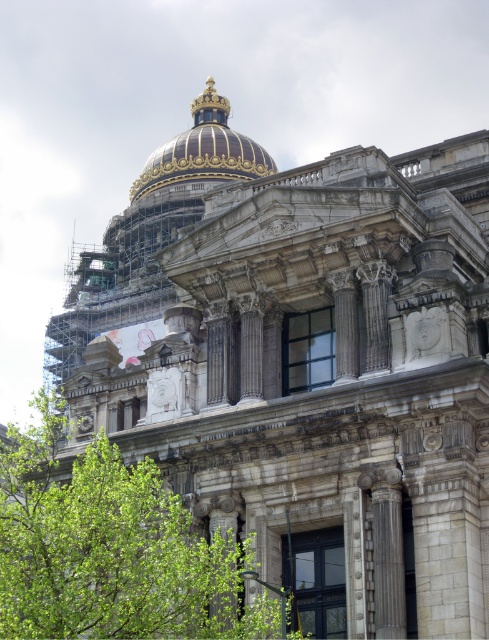
You are standing in front of the grand building and notice a point marked at coordinates (x=111, y=548). What object does this point correspond to?

The point at coordinates (x=111, y=548) corresponds to the green leafy tree at center.

You are an architect inspecting the building from the front. You notice the green leafy tree at center and the goldmetallicdome at upper center. Which object is located lower in the scene?

The green leafy tree at center is positioned under the goldmetallicdome at upper center, so the tree is lower than the dome.